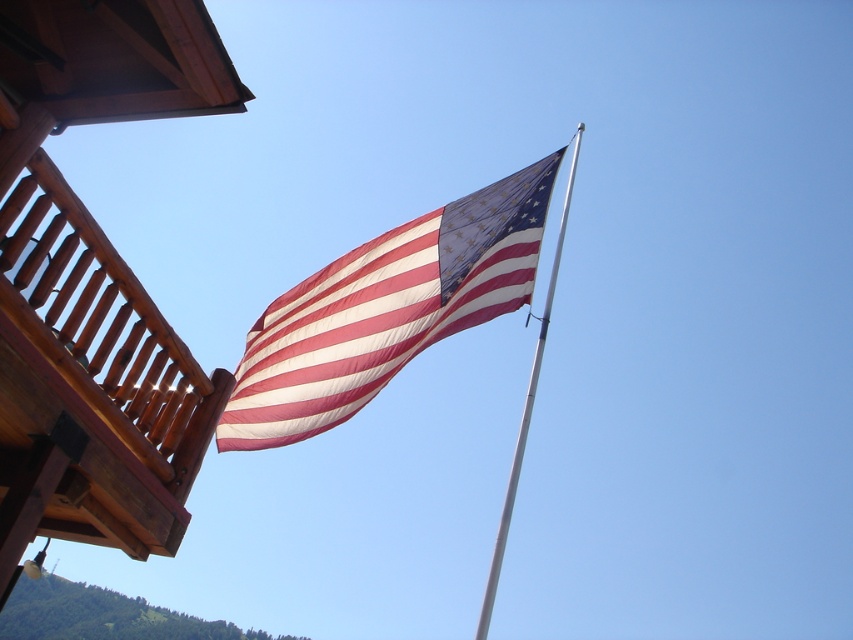
Question: Which point is farther from the camera taking this photo?

Choices:
 (A) (514, 465)
 (B) (347, 252)

Answer: (B)

Question: Does textured cotton flag at center appear on the right side of silver metallic flag pole at upper center?

Choices:
 (A) yes
 (B) no

Answer: (B)

Question: Does textured cotton flag at center appear on the right side of silver metallic flag pole at upper center?

Choices:
 (A) yes
 (B) no

Answer: (B)

Question: Which point appears closest to the camera in this image?

Choices:
 (A) (456, 321)
 (B) (541, 358)

Answer: (A)

Question: Can you confirm if textured cotton flag at center is bigger than silver metallic flag pole at upper center?

Choices:
 (A) yes
 (B) no

Answer: (B)